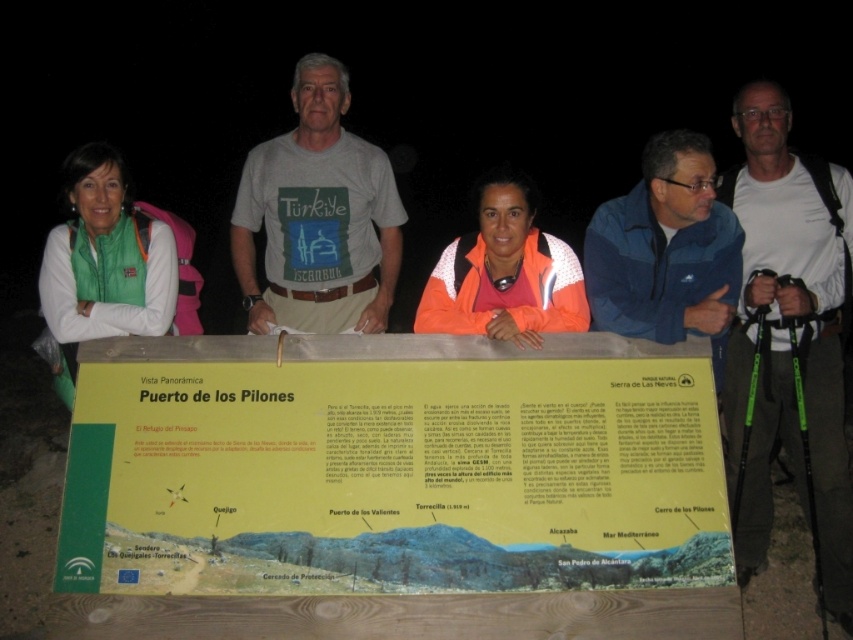
Question: Can you confirm if gray cotton t-shirt at center is positioned to the right of green fleece jacket at left?

Choices:
 (A) no
 (B) yes

Answer: (B)

Question: Which point is closer to the camera?

Choices:
 (A) gray cotton t-shirt at center
 (B) orange fleece jacket at center

Answer: (B)

Question: Which point is closer to the camera taking this photo?

Choices:
 (A) (556, 275)
 (B) (268, 212)
 (C) (102, 531)

Answer: (C)

Question: Can you confirm if white t-shirt at center is positioned below green fleece jacket at left?

Choices:
 (A) no
 (B) yes

Answer: (B)

Question: Which object appears closest to the camera in this image?

Choices:
 (A) green fleece jacket at left
 (B) gray cotton t-shirt at center

Answer: (A)

Question: Can you confirm if yellow paper sign at center is positioned to the left of white t-shirt at center?

Choices:
 (A) no
 (B) yes

Answer: (B)